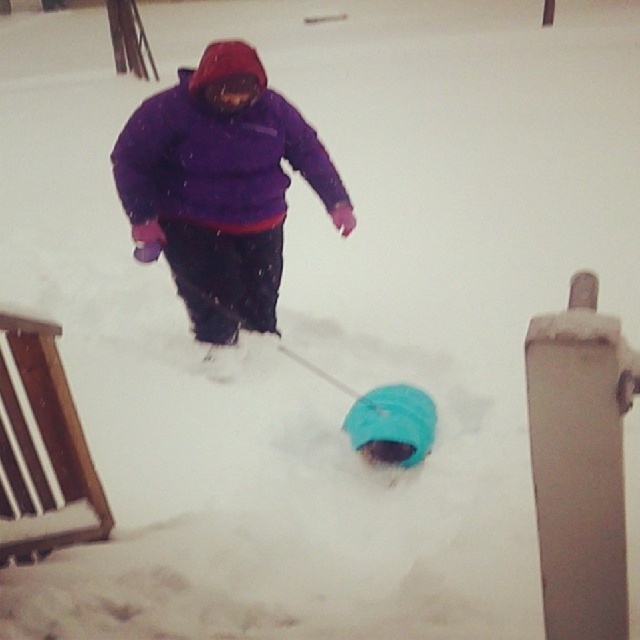
You are a photographer trying to capture a photo of the purple fleece jacket at center and the matte blue snow tube at center. Since you want to ensure both are in focus, you need to know which object is taller. Which one is taller?

The purple fleece jacket at center is taller than the matte blue snow tube at center.